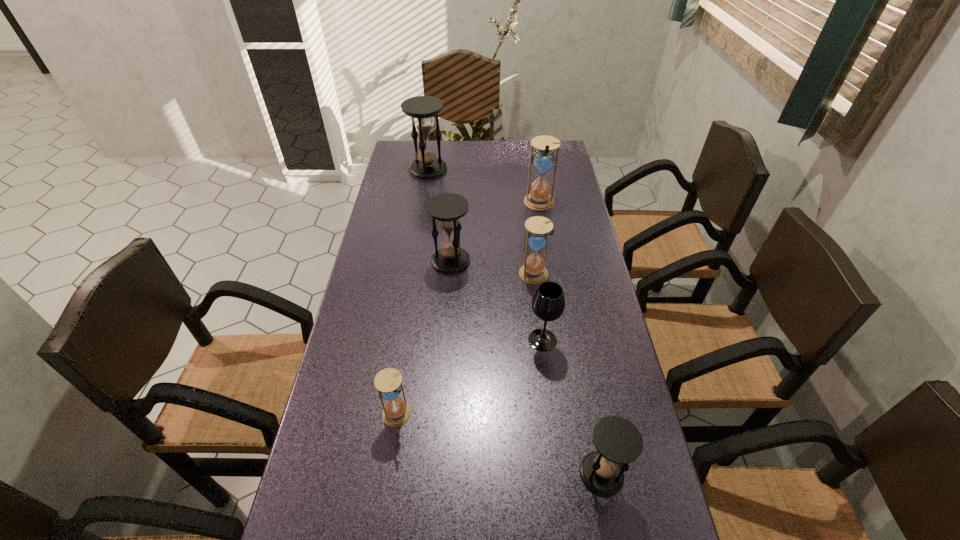
Find the location of a particular element. wineglass that is at the right edge is located at coordinates (548, 303).

Where is `object present at the far left corner`? object present at the far left corner is located at coordinates (422, 109).

In the image, there is a desktop. Find the location of `vacant space at the far edge`. vacant space at the far edge is located at coordinates (477, 170).

The image size is (960, 540). I want to click on free spot at the left edge of the desktop, so click(x=391, y=321).

Where is `vacant region at the right edge of the desktop`? vacant region at the right edge of the desktop is located at coordinates (564, 209).

Locate an element on the screen. The width and height of the screenshot is (960, 540). free region at the far left corner of the desktop is located at coordinates (410, 157).

This screenshot has height=540, width=960. Identify the location of free space between the farthest white hourglass and the second farthest black hourglass. (495, 232).

You are a GUI agent. You are given a task and a screenshot of the screen. Output one action in this format:
    pyautogui.click(x=<x>, y=<y>)
    Task: Click on the free space between the second nearest black hourglass and the biggest white hourglass
    This screenshot has width=960, height=540.
    Given the screenshot: What is the action you would take?
    pyautogui.click(x=495, y=232)

This screenshot has width=960, height=540. Identify the location of free spot between the second nearest black hourglass and the smallest black hourglass. (526, 367).

I want to click on vacant area between the wineglass and the farthest object, so click(486, 255).